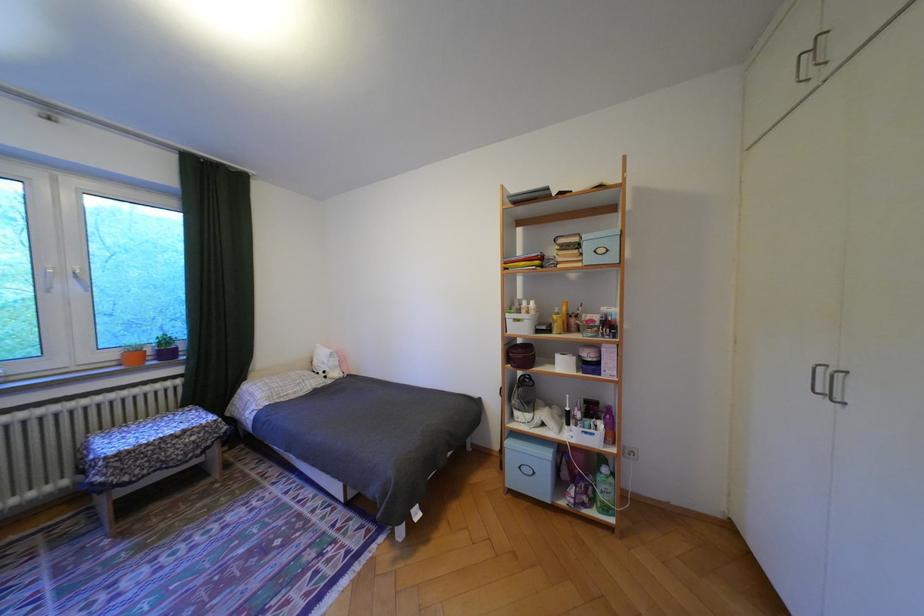
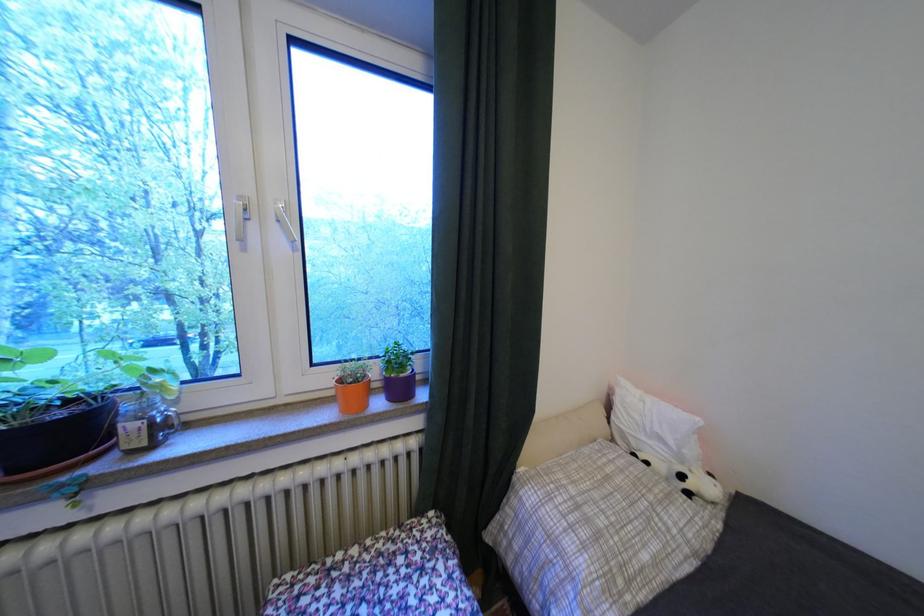
Locate, in the second image, the point that corresponds to [126,363] in the first image.

(343, 392)